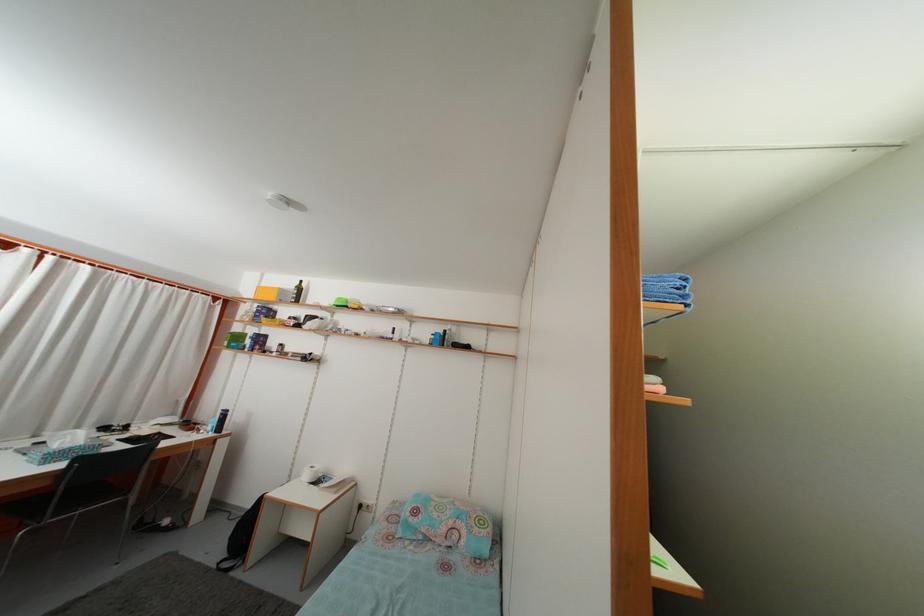
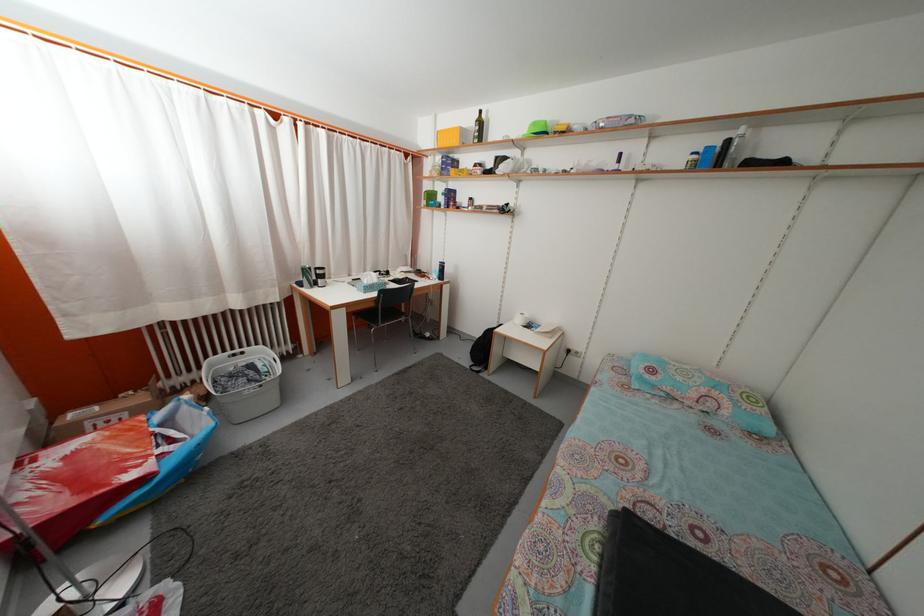
Where in the second image is the point corresponding to (x=295, y=293) from the first image?

(475, 127)